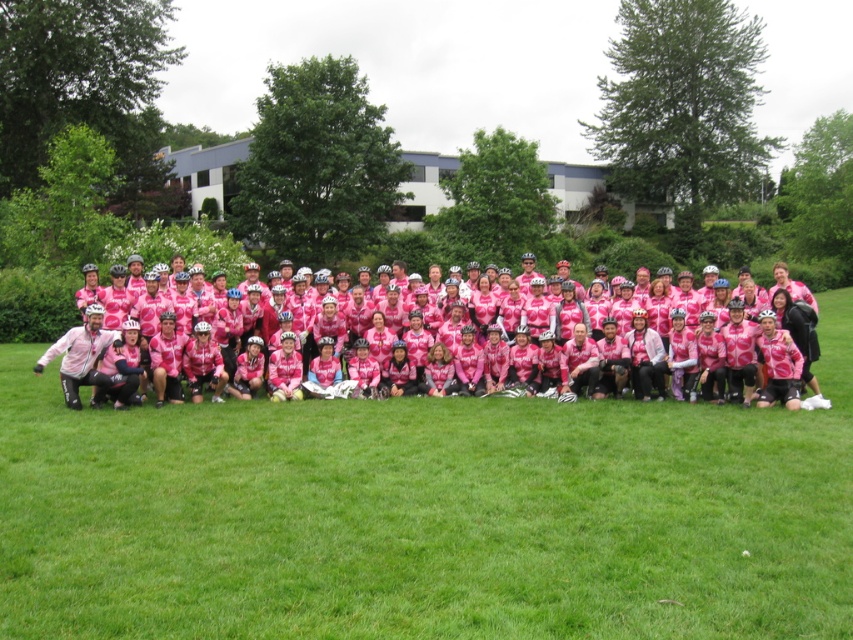
Is point (393, 547) positioned behind point (691, 324)?

No, it is in front of (691, 324).

In the scene shown: Is green grass at center further to camera compared to pink matte cycling jersey at center?

No, it is in front of pink matte cycling jersey at center.

This screenshot has height=640, width=853. Identify the location of green grass at center. (426, 515).